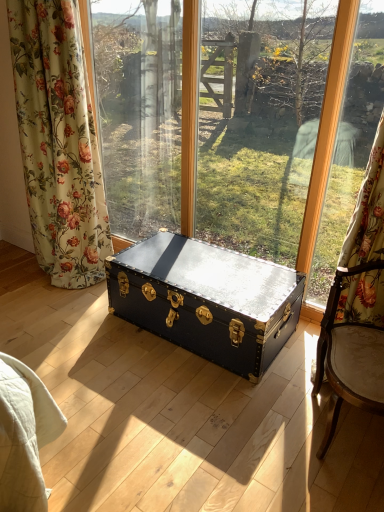
In order to click on vacant region to the left of wooden frame at right in this screenshot , I will do `click(291, 375)`.